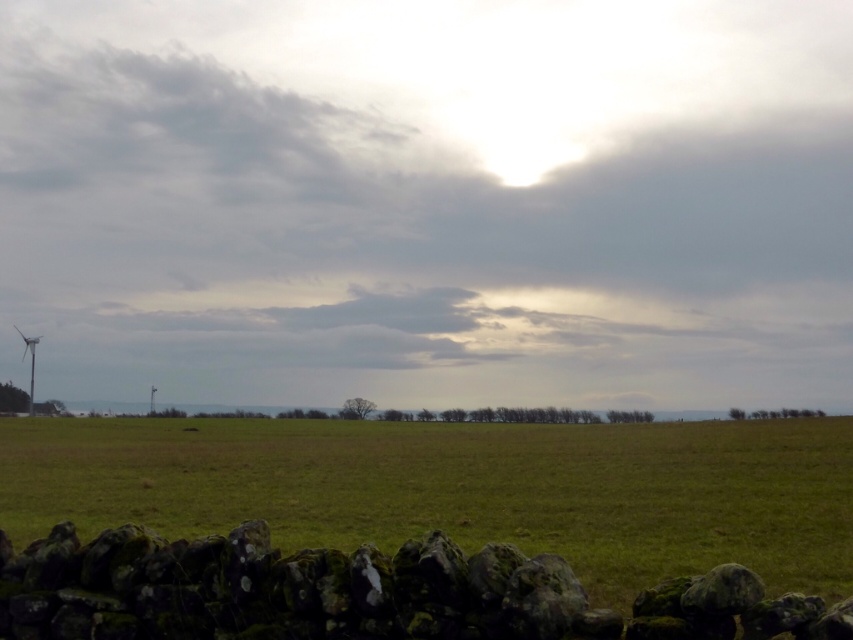
Who is shorter, green grassy field at lower center or mossy stone wall at lower center?

mossy stone wall at lower center

Can you confirm if green grassy field at lower center is bigger than mossy stone wall at lower center?

Yes, green grassy field at lower center is bigger than mossy stone wall at lower center.

Is point (195, 428) in front of point (68, 576)?

No, it is not.

At what (x,y) coordinates should I click in order to perform the action: click on green grassy field at lower center. Please return your answer as a coordinate pair (x, y). Looking at the image, I should click on [x=461, y=490].

This screenshot has height=640, width=853. What do you see at coordinates (428, 200) in the screenshot?
I see `cloudy sky at upper center` at bounding box center [428, 200].

Is point (547, 144) farther from viewer compared to point (22, 355)?

No, (547, 144) is closer to viewer.

What do you see at coordinates (428, 200) in the screenshot?
I see `cloudy sky at upper center` at bounding box center [428, 200].

This screenshot has height=640, width=853. I want to click on cloudy sky at upper center, so click(428, 200).

Does cloudy sky at upper center have a lesser height compared to mossy stone wall at lower center?

No.

Describe the element at coordinates (428, 200) in the screenshot. This screenshot has width=853, height=640. I see `cloudy sky at upper center` at that location.

Locate an element on the screen. This screenshot has height=640, width=853. cloudy sky at upper center is located at coordinates (428, 200).